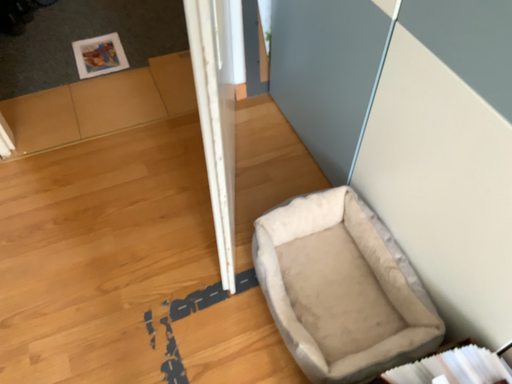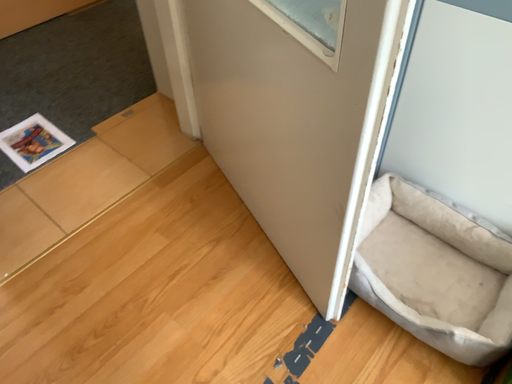
Question: Which way did the camera rotate in the video?

Choices:
 (A) rotated left
 (B) rotated right

Answer: (B)